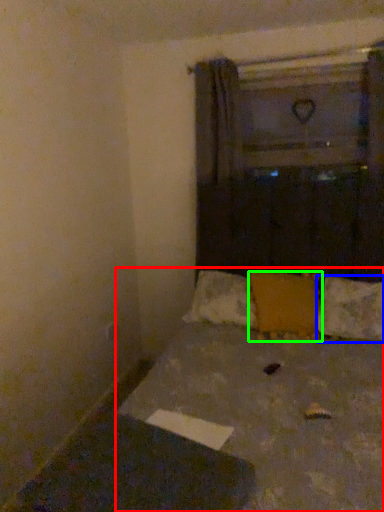
Question: Estimate the real-world distances between objects in this image. Which object is closer to bed (highlighted by a red box), pillow (highlighted by a blue box) or pillow (highlighted by a green box)?

Choices:
 (A) pillow
 (B) pillow

Answer: (B)